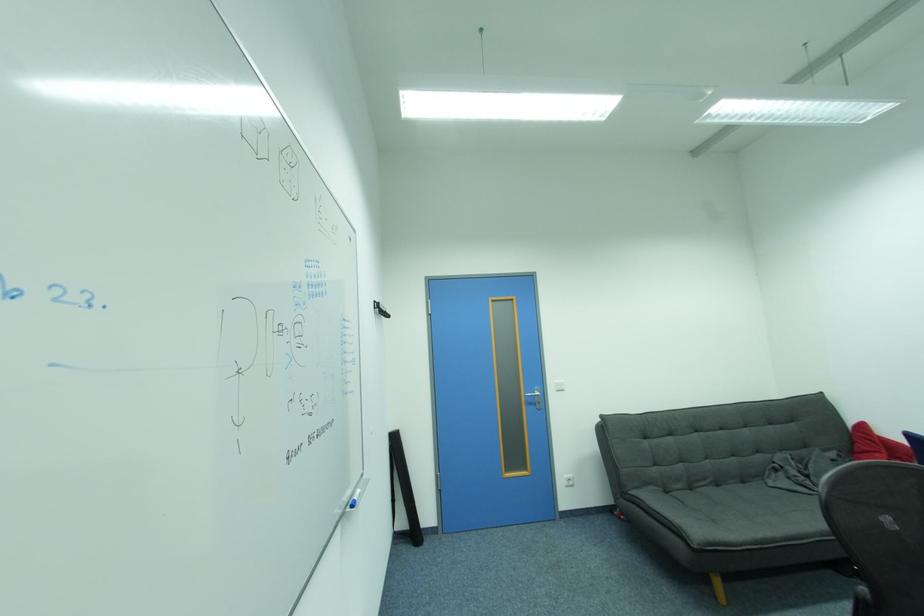
At what (x,y) coordinates should I click in order to perform the action: click on sofa sitting surface. Please return your answer as a coordinate pair (x, y). This screenshot has width=924, height=616. Looking at the image, I should click on (736, 500).